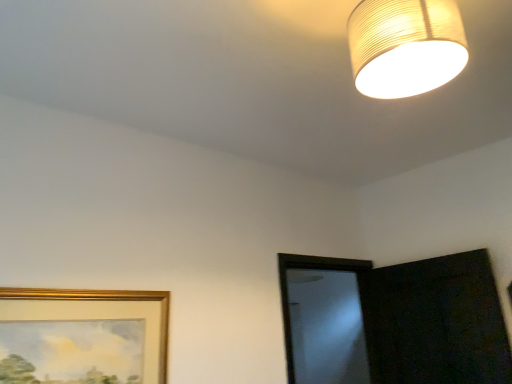
Question: Based on their positions, is matte paper lampshade at upper right located to the left or right of gold-framed picture at lower left?

Choices:
 (A) left
 (B) right

Answer: (B)

Question: Considering the positions of matte paper lampshade at upper right and gold-framed picture at lower left in the image, is matte paper lampshade at upper right wider or thinner than gold-framed picture at lower left?

Choices:
 (A) wide
 (B) thin

Answer: (A)

Question: From a real-world perspective, relative to gold-framed picture at lower left, is matte paper lampshade at upper right vertically above or below?

Choices:
 (A) below
 (B) above

Answer: (B)

Question: From a real-world perspective, relative to matte paper lampshade at upper right, is gold-framed picture at lower left vertically above or below?

Choices:
 (A) below
 (B) above

Answer: (A)

Question: Is gold-framed picture at lower left taller or shorter than matte paper lampshade at upper right?

Choices:
 (A) tall
 (B) short

Answer: (A)

Question: Is point (166, 342) positioned closer to the camera than point (451, 28)?

Choices:
 (A) closer
 (B) farther

Answer: (B)

Question: Considering the relative positions of gold-framed picture at lower left and matte paper lampshade at upper right in the image provided, is gold-framed picture at lower left to the left or to the right of matte paper lampshade at upper right?

Choices:
 (A) left
 (B) right

Answer: (A)